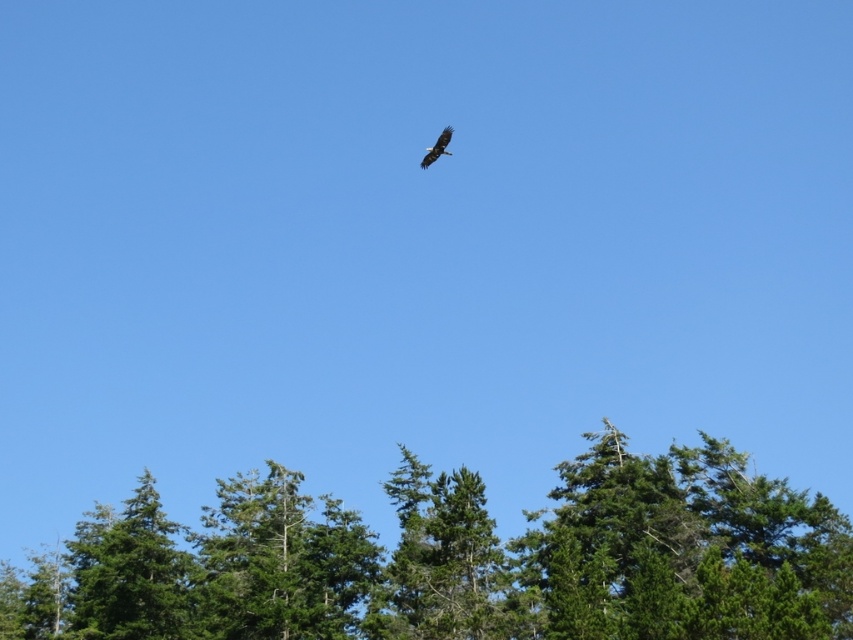
Does green textured tree at center appear over dark brown eagle at upper center?

No, green textured tree at center is not above dark brown eagle at upper center.

Does green textured tree at center have a lesser width compared to dark brown eagle at upper center?

In fact, green textured tree at center might be wider than dark brown eagle at upper center.

Who is more forward, (x=674, y=445) or (x=445, y=129)?

Point (x=445, y=129)

Find the location of a particular element. green textured tree at center is located at coordinates (457, 560).